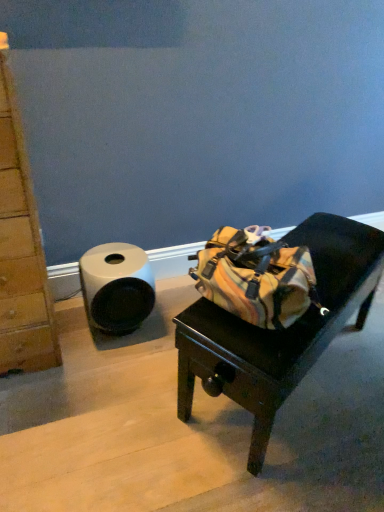
The width and height of the screenshot is (384, 512). What are the coordinates of `free space on the front side of white matte toilet paper at left` in the screenshot? It's located at (106, 369).